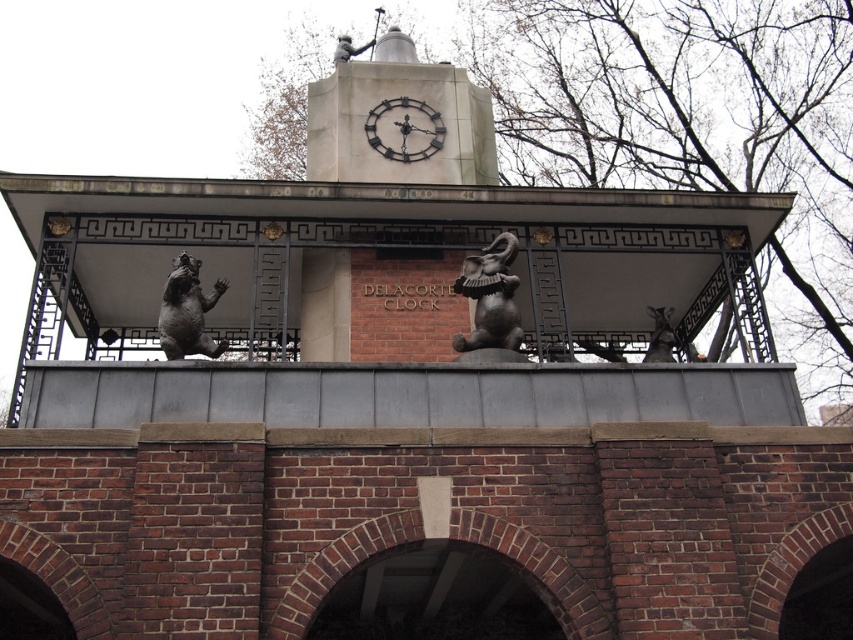
Which is more to the left, shiny bronze elephant at center or shiny bronze bear at upper left?

shiny bronze bear at upper left is more to the left.

Does shiny bronze elephant at center have a larger size compared to shiny bronze bear at upper left?

Yes.

The width and height of the screenshot is (853, 640). I want to click on shiny bronze elephant at center, so click(490, 298).

Where is `shiny bronze elephant at center`? The height and width of the screenshot is (640, 853). shiny bronze elephant at center is located at coordinates (490, 298).

Does point (196, 288) come behind point (381, 141)?

No, it is not.

Is shiny bronze bear at upper left thinner than metallic clock at center?

Indeed, shiny bronze bear at upper left has a lesser width compared to metallic clock at center.

Is point (177, 280) farther from camera compared to point (405, 152)?

No, it is not.

Locate an element on the screen. shiny bronze bear at upper left is located at coordinates (187, 310).

Can you confirm if shiny bronze elephant at center is taller than metallic clock at center?

Yes, shiny bronze elephant at center is taller than metallic clock at center.

Does shiny bronze elephant at center have a lesser width compared to metallic clock at center?

Indeed, shiny bronze elephant at center has a lesser width compared to metallic clock at center.

Between point (498, 257) and point (364, 124), which one is positioned behind?

Point (364, 124)

This screenshot has height=640, width=853. Find the location of `shiny bronze elephant at center`. shiny bronze elephant at center is located at coordinates (490, 298).